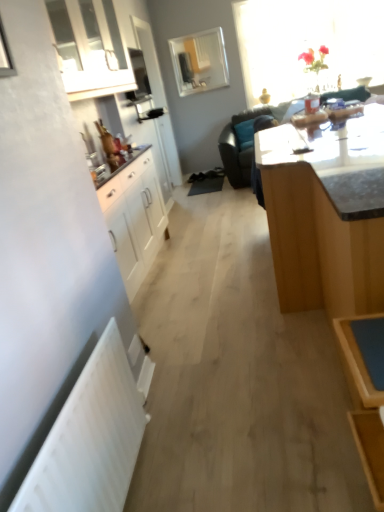
Question: Can you confirm if white glossy cabinet at upper left is positioned to the right of translucent glass vase at upper right, marked as the first window in a right-to-left arrangement?

Choices:
 (A) yes
 (B) no

Answer: (B)

Question: Considering the relative sizes of white glossy cabinet at upper left and translucent glass vase at upper right, marked as the first window in a right-to-left arrangement, in the image provided, is white glossy cabinet at upper left bigger than translucent glass vase at upper right, marked as the first window in a right-to-left arrangement,?

Choices:
 (A) yes
 (B) no

Answer: (B)

Question: Is white glossy cabinet at upper left not inside translucent glass vase at upper right, marked as the first window in a right-to-left arrangement?

Choices:
 (A) yes
 (B) no

Answer: (A)

Question: Considering the relative positions of white glossy cabinet at upper left and translucent glass vase at upper right, positioned as the 2th window in left-to-right order, in the image provided, is white glossy cabinet at upper left in front of translucent glass vase at upper right, positioned as the 2th window in left-to-right order,?

Choices:
 (A) no
 (B) yes

Answer: (B)

Question: Does white glossy cabinet at upper left have a lesser height compared to translucent glass vase at upper right, positioned as the 2th window in left-to-right order?

Choices:
 (A) yes
 (B) no

Answer: (A)

Question: Based on their positions, is white glossy cabinet at upper left located to the left or right of black leather couch at upper center?

Choices:
 (A) right
 (B) left

Answer: (B)

Question: Considering the positions of white glossy cabinet at upper left and black leather couch at upper center in the image, is white glossy cabinet at upper left taller or shorter than black leather couch at upper center?

Choices:
 (A) short
 (B) tall

Answer: (A)

Question: Looking at the image, does white glossy cabinet at upper left seem bigger or smaller compared to black leather couch at upper center?

Choices:
 (A) small
 (B) big

Answer: (A)

Question: Looking at their shapes, would you say white glossy cabinet at upper left is wider or thinner than black leather couch at upper center?

Choices:
 (A) thin
 (B) wide

Answer: (A)

Question: Considering their positions, is white matte radiator at lower left located in front of or behind white glossy cabinet at upper left?

Choices:
 (A) behind
 (B) front

Answer: (B)

Question: Is white matte radiator at lower left situated inside white glossy cabinet at upper left or outside?

Choices:
 (A) inside
 (B) outside

Answer: (B)

Question: From the image's perspective, is white matte radiator at lower left located above or below white glossy cabinet at upper left?

Choices:
 (A) below
 (B) above

Answer: (A)

Question: Is white matte radiator at lower left wider or thinner than white glossy cabinet at upper left?

Choices:
 (A) wide
 (B) thin

Answer: (B)

Question: From a real-world perspective, relative to black leather couch at upper center, is white matte radiator at lower left vertically above or below?

Choices:
 (A) above
 (B) below

Answer: (B)

Question: From the image's perspective, is white matte radiator at lower left above or below black leather couch at upper center?

Choices:
 (A) below
 (B) above

Answer: (A)